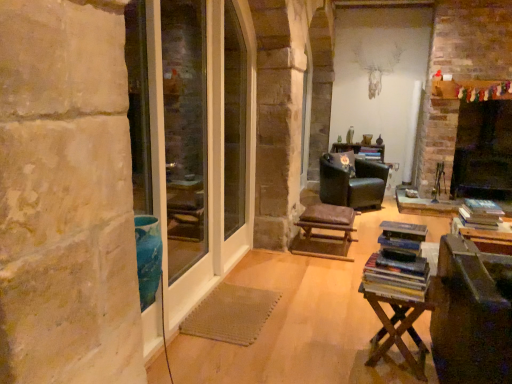
Question: Considering the positions of wooden table at lower right and brown leather stool at center in the image, is wooden table at lower right bigger or smaller than brown leather stool at center?

Choices:
 (A) big
 (B) small

Answer: (B)

Question: Is wooden table at lower right situated inside brown leather stool at center or outside?

Choices:
 (A) outside
 (B) inside

Answer: (A)

Question: Estimate the real-world distances between objects in this image. Which object is farther from the black leather chair at center?

Choices:
 (A) wooden table at lower right
 (B) brown leather stool at center
 (C) clear glass screen door at left, which is the 2th screen door in left-to-right order
 (D) clear glass door at left, the second screen door when ordered from right to left
 (E) clear glass window screen at center

Answer: (A)

Question: Based on their relative distances, which object is farther from the clear glass window screen at center?

Choices:
 (A) hardcover books at center right
 (B) black matte fireplace at right
 (C) wooden table at lower right
 (D) clear glass door at left, the second screen door when ordered from right to left
 (E) brown leather stool at center

Answer: (B)